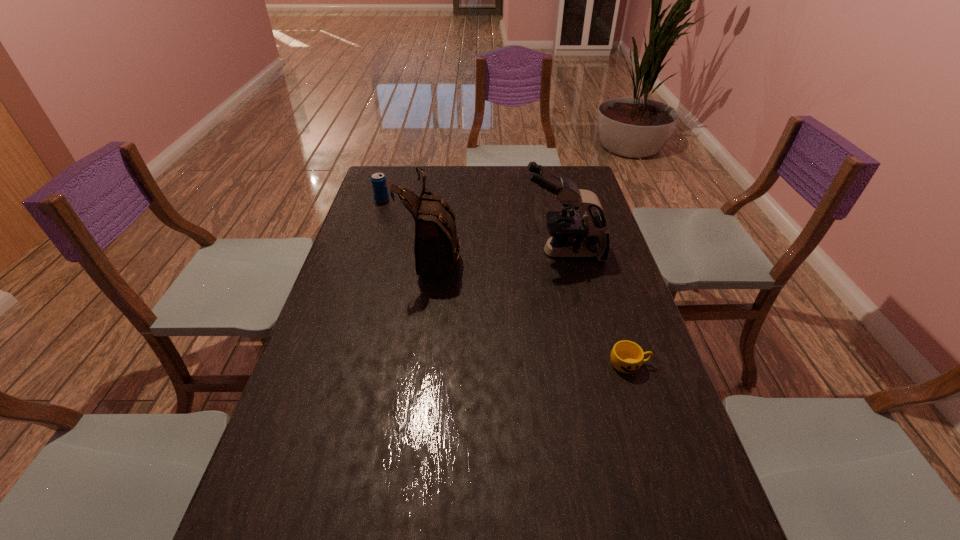
The width and height of the screenshot is (960, 540). Identify the location of vacant space positioned 0.060m on the right of the soda can. (404, 200).

What are the coordinates of `vacant space situated 0.110m on the back of the nearest object` in the screenshot? It's located at (616, 321).

Identify the location of object present at the left edge. (379, 184).

Identify the location of microscope positioned at the right edge. (571, 235).

The image size is (960, 540). I want to click on cup at the right edge, so click(x=627, y=357).

Locate an element on the screen. The image size is (960, 540). vacant space at the far edge of the desktop is located at coordinates (413, 176).

Identify the location of blank space at the left edge of the desktop. (390, 249).

In the image, there is a desktop. Where is `vacant area at the right edge`? Image resolution: width=960 pixels, height=540 pixels. vacant area at the right edge is located at coordinates (608, 278).

In the image, there is a desktop. At what (x,y) coordinates should I click in order to perform the action: click on free space at the far left corner. Please return your answer as a coordinate pair (x, y). This screenshot has height=540, width=960. Looking at the image, I should click on (405, 176).

I want to click on vacant space that is in between the leftmost object and the shoulder bag, so click(408, 227).